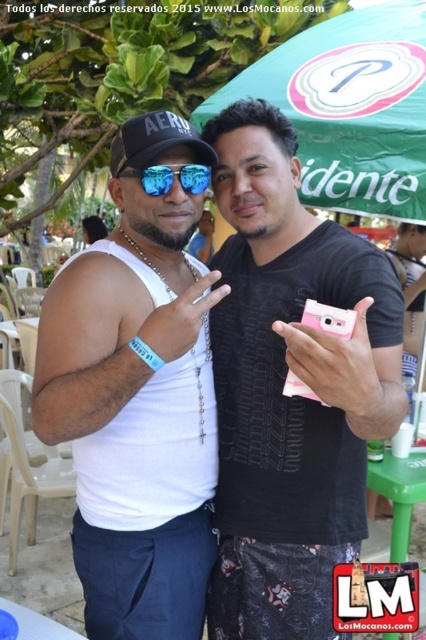
You are a photographer trying to capture a clear shot of the shiny reflective sunglasses at center and the green fabric canopy at upper center. Which object is blocking the view of the other?

The shiny reflective sunglasses at center is behind the green fabric canopy at upper center, so the green fabric canopy at upper center is blocking the view of the shiny reflective sunglasses at center.

You are a photographer adjusting your camera settings to avoid glare. You notice the black matte baseball cap at upper left and the shiny reflective sunglasses at center. Which object might cause more glare and require you to adjust your camera settings?

The shiny reflective sunglasses at center are more likely to cause glare because they are reflective, whereas the black matte baseball cap at upper left has a matte finish which absorbs more light and reflects less.